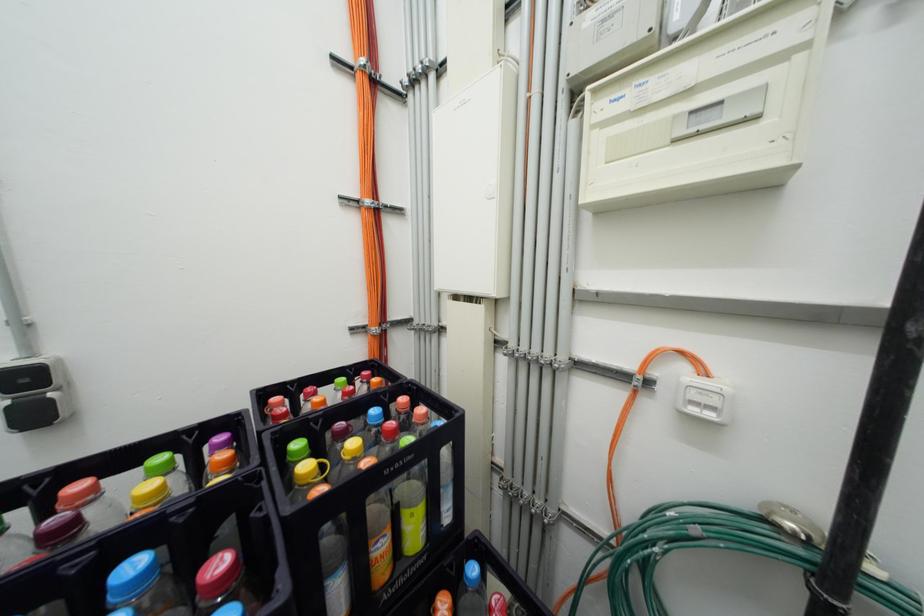
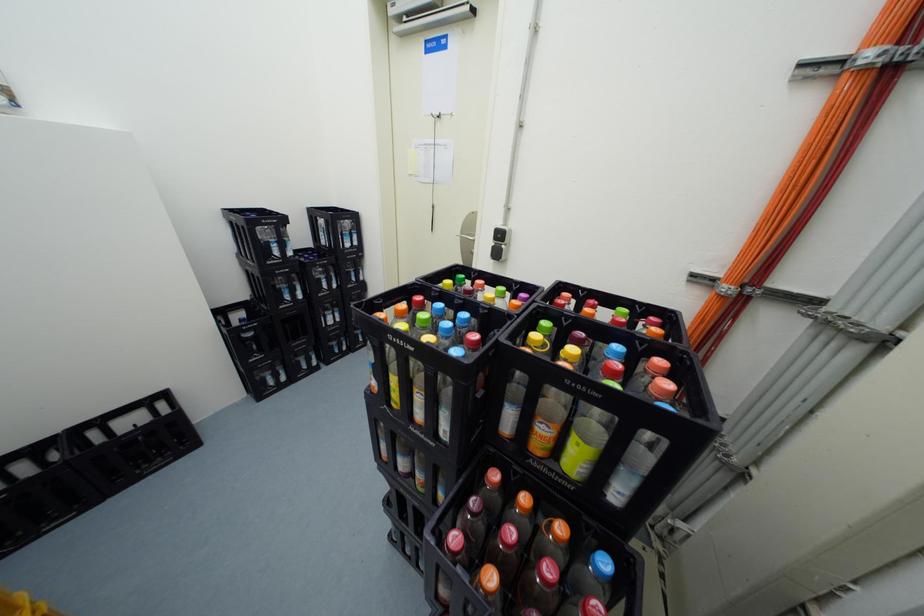
The images are taken continuously from a first-person perspective. In which direction is your viewpoint rotating?

The rotation direction of the camera is left-down.